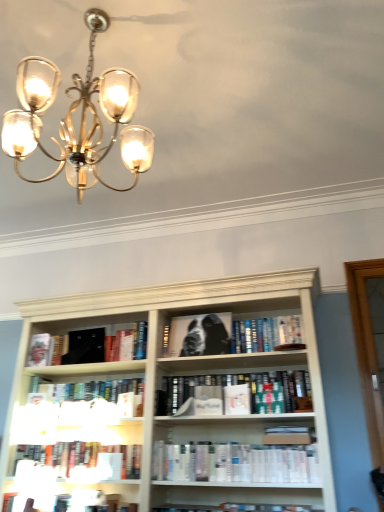
Question: Is hardcover book at center, the sixth book in the bottom-to-top sequence, oriented towards black matte book at left, placed as the 7th book when sorted from bottom to top?

Choices:
 (A) no
 (B) yes

Answer: (A)

Question: Does hardcover book at center, positioned as the 3th book in top-to-bottom order, have a greater height compared to black matte book at left, the second book positioned from the top?

Choices:
 (A) no
 (B) yes

Answer: (B)

Question: Would you consider hardcover book at center, the sixth book in the bottom-to-top sequence, to be distant from black matte book at left, placed as the 7th book when sorted from bottom to top?

Choices:
 (A) yes
 (B) no

Answer: (B)

Question: From the image's perspective, is hardcover book at center, positioned as the 3th book in top-to-bottom order, under black matte book at left, the second book positioned from the top?

Choices:
 (A) no
 (B) yes

Answer: (B)

Question: Is hardcover book at center, the sixth book in the bottom-to-top sequence, at the right side of black matte book at left, the second book positioned from the top?

Choices:
 (A) yes
 (B) no

Answer: (A)

Question: Does hardcover book at center, positioned as the 3th book in top-to-bottom order, lie behind black matte book at left, placed as the 7th book when sorted from bottom to top?

Choices:
 (A) no
 (B) yes

Answer: (A)

Question: From the image's perspective, is white paperbacks at center, the 4th book in the bottom-to-top sequence, located beneath hardcover books at lower center, which ranks as the sixth book in top-to-bottom order?

Choices:
 (A) yes
 (B) no

Answer: (B)

Question: Considering the relative sizes of white paperbacks at center, the 4th book in the bottom-to-top sequence, and hardcover books at lower center, the third book in the bottom-to-top sequence, in the image provided, is white paperbacks at center, the 4th book in the bottom-to-top sequence, smaller than hardcover books at lower center, the third book in the bottom-to-top sequence,?

Choices:
 (A) yes
 (B) no

Answer: (B)

Question: Considering the relative sizes of white paperbacks at center, the fifth book in the top-to-bottom sequence, and hardcover books at lower center, which ranks as the sixth book in top-to-bottom order, in the image provided, is white paperbacks at center, the fifth book in the top-to-bottom sequence, wider than hardcover books at lower center, which ranks as the sixth book in top-to-bottom order,?

Choices:
 (A) no
 (B) yes

Answer: (B)

Question: Is white paperbacks at center, the 4th book in the bottom-to-top sequence, facing towards hardcover books at lower center, the third book in the bottom-to-top sequence?

Choices:
 (A) yes
 (B) no

Answer: (B)

Question: From a real-world perspective, is white paperbacks at center, the fifth book in the top-to-bottom sequence, under hardcover books at lower center, the third book in the bottom-to-top sequence?

Choices:
 (A) yes
 (B) no

Answer: (A)

Question: Considering the relative sizes of white paperbacks at center, the 4th book in the bottom-to-top sequence, and hardcover books at lower center, which ranks as the sixth book in top-to-bottom order, in the image provided, is white paperbacks at center, the 4th book in the bottom-to-top sequence, taller than hardcover books at lower center, which ranks as the sixth book in top-to-bottom order,?

Choices:
 (A) no
 (B) yes

Answer: (A)

Question: Is black matte book at left, the second book positioned from the top, oriented towards matte gold chandelier at upper left?

Choices:
 (A) no
 (B) yes

Answer: (A)